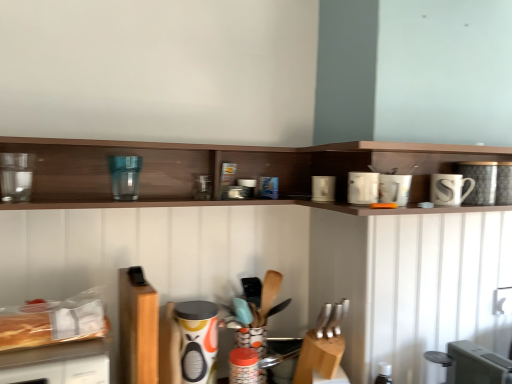
Question: Should I look upward or downward to see wooden spoon at center, which is counted as the 2th silverware, starting from the right?

Choices:
 (A) down
 (B) up

Answer: (A)

Question: Is matte plastic container at center, the eighth appliance viewed from the right, surrounding white glossy coffee cup at upper right, which is the fourth appliance in right-to-left order?

Choices:
 (A) yes
 (B) no

Answer: (B)

Question: Is matte plastic container at center, the eighth appliance viewed from the right, aimed at white glossy coffee cup at upper right, which is the fourth appliance in right-to-left order?

Choices:
 (A) yes
 (B) no

Answer: (B)

Question: Is matte plastic container at center, the eighth appliance viewed from the right, oriented away from white glossy coffee cup at upper right, the seventh appliance from the left?

Choices:
 (A) no
 (B) yes

Answer: (A)

Question: Considering the relative positions of matte plastic container at center, the 3th appliance from the left, and white glossy coffee cup at upper right, the seventh appliance from the left, in the image provided, is matte plastic container at center, the 3th appliance from the left, behind white glossy coffee cup at upper right, the seventh appliance from the left,?

Choices:
 (A) no
 (B) yes

Answer: (B)

Question: Considering the relative sizes of matte plastic container at center, the eighth appliance viewed from the right, and white glossy coffee cup at upper right, the seventh appliance from the left, in the image provided, is matte plastic container at center, the eighth appliance viewed from the right, bigger than white glossy coffee cup at upper right, the seventh appliance from the left,?

Choices:
 (A) no
 (B) yes

Answer: (B)

Question: Can you confirm if matte plastic container at center, the 3th appliance from the left, is shorter than white glossy coffee cup at upper right, the seventh appliance from the left?

Choices:
 (A) yes
 (B) no

Answer: (B)

Question: Is white glossy toaster at upper right, arranged as the sixth appliance when viewed from the left, at the right side of white glossy coffee cup at upper right, the seventh appliance from the left?

Choices:
 (A) yes
 (B) no

Answer: (B)

Question: Is the surface of white glossy toaster at upper right, arranged as the sixth appliance when viewed from the left, in direct contact with white glossy coffee cup at upper right, the seventh appliance from the left?

Choices:
 (A) yes
 (B) no

Answer: (B)

Question: Is white glossy toaster at upper right, marked as the 5th appliance in a right-to-left arrangement, smaller than white glossy coffee cup at upper right, the seventh appliance from the left?

Choices:
 (A) no
 (B) yes

Answer: (B)

Question: Is white glossy toaster at upper right, arranged as the sixth appliance when viewed from the left, positioned before white glossy coffee cup at upper right, which is the fourth appliance in right-to-left order?

Choices:
 (A) yes
 (B) no

Answer: (B)

Question: From the image's perspective, is white glossy toaster at upper right, marked as the 5th appliance in a right-to-left arrangement, above white glossy coffee cup at upper right, the seventh appliance from the left?

Choices:
 (A) no
 (B) yes

Answer: (A)

Question: Is white glossy toaster at upper right, marked as the 5th appliance in a right-to-left arrangement, further to the viewer compared to white glossy coffee cup at upper right, which is the fourth appliance in right-to-left order?

Choices:
 (A) yes
 (B) no

Answer: (A)

Question: From a real-world perspective, is white ceramic mug at upper right, the third appliance in the right-to-left sequence, physically above silver metallic knives at center, which appears as the 1th silverware when viewed from the front?

Choices:
 (A) no
 (B) yes

Answer: (B)